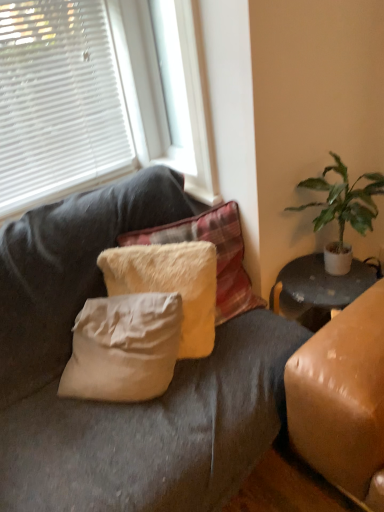
Question: Should I look upward or downward to see green leafy plant at right?

Choices:
 (A) down
 (B) up

Answer: (B)

Question: Is fuzzy white pillow at center, the 1th pillow positioned from the bottom, to the left of green leafy plant at right from the viewer's perspective?

Choices:
 (A) no
 (B) yes

Answer: (B)

Question: Can you confirm if fuzzy white pillow at center, the 1th pillow positioned from the bottom, is shorter than green leafy plant at right?

Choices:
 (A) no
 (B) yes

Answer: (B)

Question: Does fuzzy white pillow at center, acting as the second pillow starting from the top, have a smaller size compared to green leafy plant at right?

Choices:
 (A) no
 (B) yes

Answer: (B)

Question: Does fuzzy white pillow at center, acting as the second pillow starting from the top, come behind green leafy plant at right?

Choices:
 (A) no
 (B) yes

Answer: (B)

Question: From a real-world perspective, is fuzzy white pillow at center, the 1th pillow positioned from the bottom, physically above green leafy plant at right?

Choices:
 (A) no
 (B) yes

Answer: (A)

Question: Can you confirm if fuzzy white pillow at center, acting as the second pillow starting from the top, is taller than green leafy plant at right?

Choices:
 (A) yes
 (B) no

Answer: (B)

Question: From the image's perspective, is fuzzy white pillow at center, acting as the 1th pillow starting from the top, over green leafy plant at right?

Choices:
 (A) yes
 (B) no

Answer: (B)

Question: From a real-world perspective, does fuzzy white pillow at center, marked as the 2th pillow in a bottom-to-top arrangement, sit lower than green leafy plant at right?

Choices:
 (A) yes
 (B) no

Answer: (A)

Question: Is fuzzy white pillow at center, acting as the 1th pillow starting from the top, smaller than green leafy plant at right?

Choices:
 (A) no
 (B) yes

Answer: (A)

Question: Considering the relative positions of fuzzy white pillow at center, marked as the 2th pillow in a bottom-to-top arrangement, and green leafy plant at right in the image provided, is fuzzy white pillow at center, marked as the 2th pillow in a bottom-to-top arrangement, to the left of green leafy plant at right from the viewer's perspective?

Choices:
 (A) yes
 (B) no

Answer: (A)

Question: Can you confirm if fuzzy white pillow at center, acting as the 1th pillow starting from the top, is thinner than green leafy plant at right?

Choices:
 (A) no
 (B) yes

Answer: (B)

Question: Is fuzzy white pillow at center, marked as the 2th pillow in a bottom-to-top arrangement, outside of green leafy plant at right?

Choices:
 (A) no
 (B) yes

Answer: (B)

Question: From the image's perspective, is white plastic window frame at upper center over fuzzy white pillow at center, acting as the second pillow starting from the top?

Choices:
 (A) no
 (B) yes

Answer: (B)